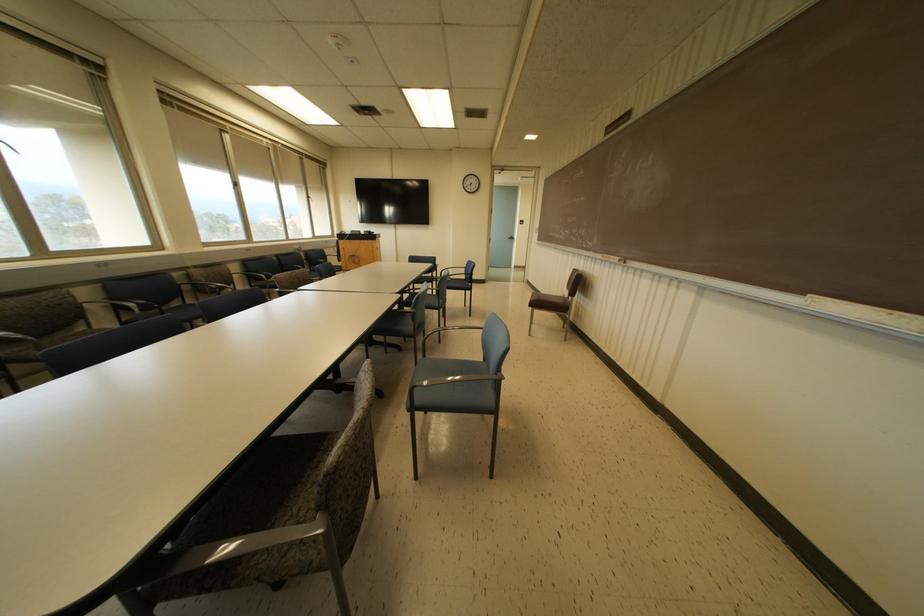
You are a GUI agent. You are given a task and a screenshot of the screen. Output one action in this format:
    pyautogui.click(x=<x>, y=<y>)
    Task: Click on the patterned chair armrest
    
    Given the screenshot: What is the action you would take?
    pyautogui.click(x=227, y=556)